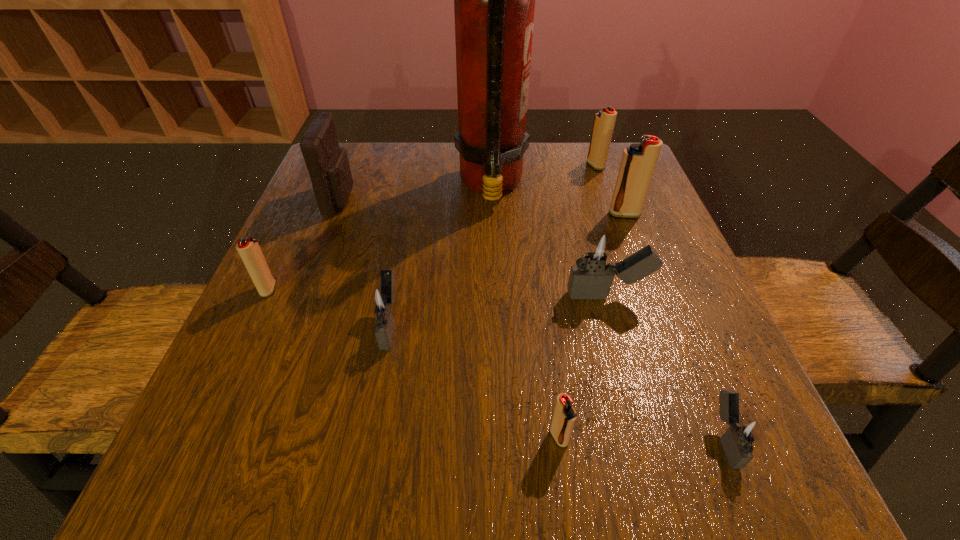
Locate an element on the screen. The height and width of the screenshot is (540, 960). fire extinguisher is located at coordinates (494, 0).

Where is `the tallest object`? the tallest object is located at coordinates (494, 0).

You are a GUI agent. You are given a task and a screenshot of the screen. Output one action in this format:
    pyautogui.click(x=<x>, y=<y>)
    Task: Click on the third nearest red igniter
    This screenshot has height=540, width=960.
    Given the screenshot: What is the action you would take?
    pyautogui.click(x=638, y=163)

I want to click on the sixth nearest igniter, so click(x=638, y=163).

At what (x,y) coordinates should I click in order to perform the action: click on pouch. Please return your answer as a coordinate pair (x, y). Looking at the image, I should click on (327, 163).

Image resolution: width=960 pixels, height=540 pixels. What are the coordinates of `the third smallest red igniter` in the screenshot? It's located at (604, 121).

The image size is (960, 540). What are the coordinates of `the farthest igniter` in the screenshot? It's located at (604, 121).

Find the location of a particular element. The width and height of the screenshot is (960, 540). the second gray igniter from right to left is located at coordinates (595, 263).

Locate an element on the screen. the second biggest gray igniter is located at coordinates (382, 300).

Locate an element on the screen. the seventh object from right to left is located at coordinates (382, 300).